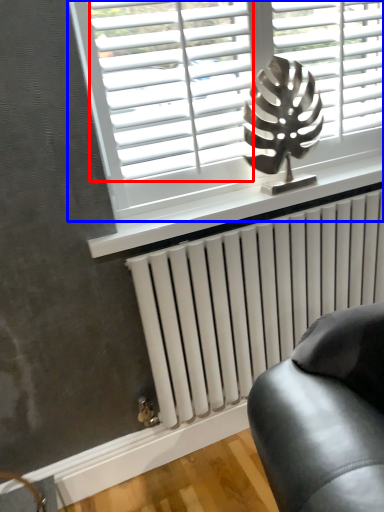
Question: Which object appears farthest to the camera in this image, blind (highlighted by a red box) or window (highlighted by a blue box)?

Choices:
 (A) blind
 (B) window

Answer: (B)